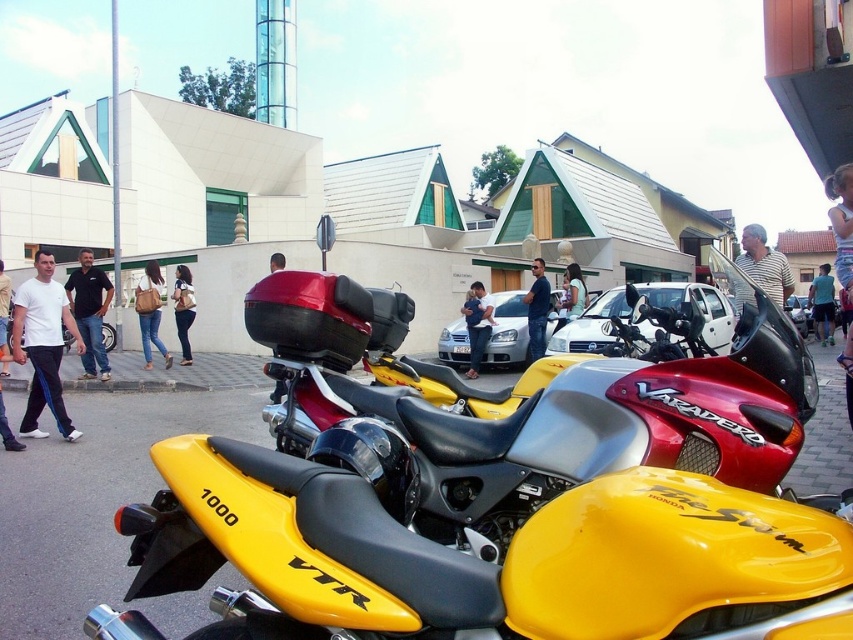
Is matte gray shirt at center above denim shorts at lower right?

Actually, matte gray shirt at center is below denim shorts at lower right.

Based on the photo, does matte gray shirt at center have a larger size compared to denim shorts at lower right?

No.

Does point (778, 273) come farther from viewer compared to point (842, 273)?

Yes, it is.

The image size is (853, 640). Find the location of `matte gray shirt at center`. matte gray shirt at center is located at coordinates coord(764,264).

Between matte black shirt at center and light blue jeans at center, which one appears on the left side from the viewer's perspective?

From the viewer's perspective, matte black shirt at center appears more on the left side.

Identify the location of matte black shirt at center. The width and height of the screenshot is (853, 640). (537, 308).

Is light blue jeans at center further to camera compared to denim pants at center?

Yes, it is.

Is point (825, 266) farther from viewer compared to point (183, 289)?

Yes, point (825, 266) is behind point (183, 289).

Locate an element on the screen. light blue jeans at center is located at coordinates (822, 304).